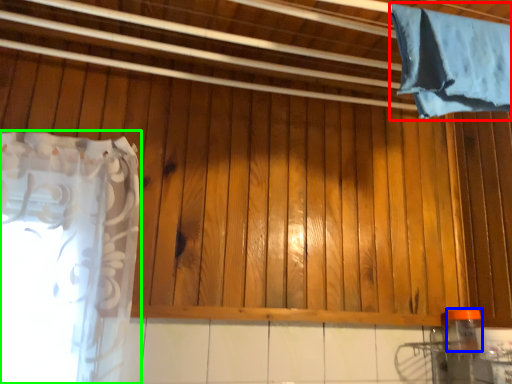
Question: Considering the real-world distances, which object is closest to curtain (highlighted by a red box)? bottle (highlighted by a blue box) or curtain (highlighted by a green box).

Choices:
 (A) bottle
 (B) curtain

Answer: (A)